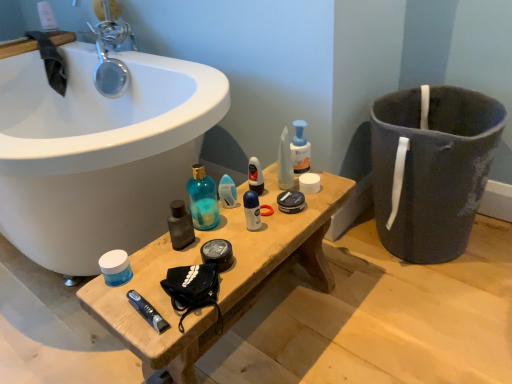
In order to click on free point behind blue matte toothpaste at center in this screenshot , I will do `click(170, 261)`.